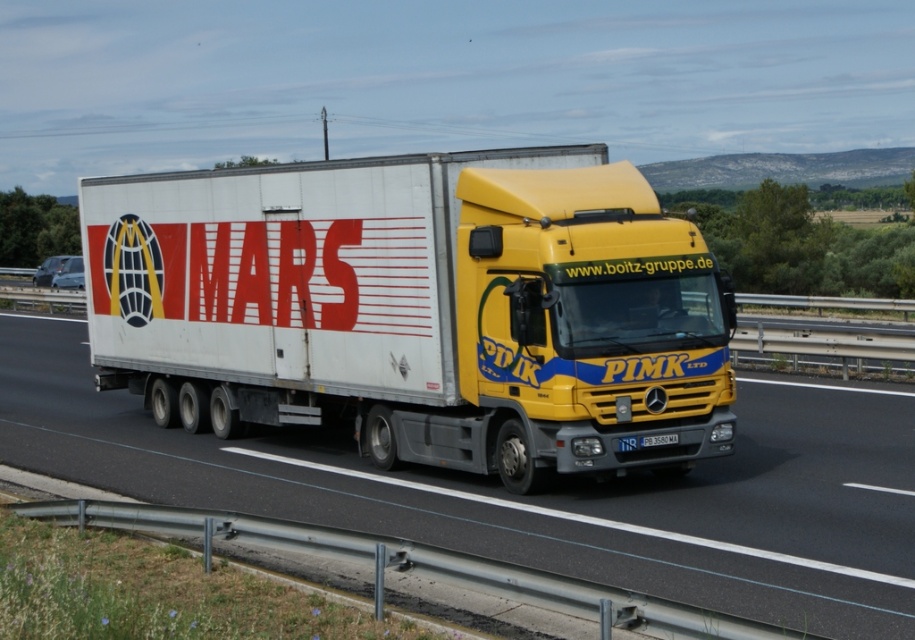
Question: Can you confirm if white matte trailer at center is positioned below white matte truck at center?

Choices:
 (A) no
 (B) yes

Answer: (A)

Question: Considering the real-world distances, which object is farthest from the white matte truck at center?

Choices:
 (A) white plastic license plate at center
 (B) white matte trailer at center

Answer: (A)

Question: Among these objects, which one is nearest to the camera?

Choices:
 (A) white plastic license plate at center
 (B) white matte trailer at center
 (C) white matte truck at center

Answer: (C)

Question: Is white matte truck at center positioned behind white plastic license plate at center?

Choices:
 (A) yes
 (B) no

Answer: (B)

Question: Where is white matte trailer at center located in relation to white matte truck at center in the image?

Choices:
 (A) above
 (B) below

Answer: (A)

Question: Which point appears closest to the camera in this image?

Choices:
 (A) (205, 451)
 (B) (316, 234)

Answer: (B)